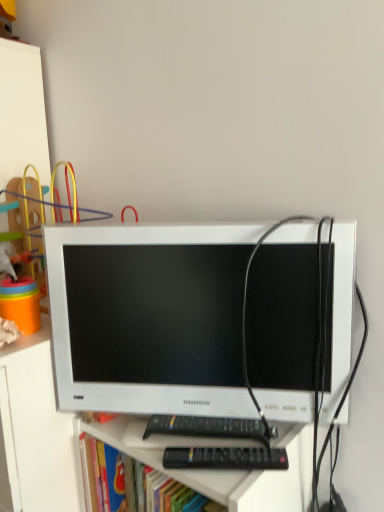
The height and width of the screenshot is (512, 384). What are the coordinates of `white matte file cabinet at left` in the screenshot? It's located at (34, 431).

Looking at this image, does white glossy computer monitor at center have a lesser height compared to black plastic remote at lower center?

No, white glossy computer monitor at center is not shorter than black plastic remote at lower center.

From a real-world perspective, is white glossy computer monitor at center below black plastic remote at lower center?

No, from a real-world perspective, white glossy computer monitor at center is not beneath black plastic remote at lower center.

This screenshot has height=512, width=384. What are the coordinates of `control below the white glossy computer monitor at center (from a real-world perspective)` in the screenshot? It's located at (225, 458).

Are white glossy computer monitor at center and black plastic remote at lower center beside each other?

No, white glossy computer monitor at center is not with black plastic remote at lower center.

Does white glossy computer monitor at center touch white matte file cabinet at left?

There is a gap between white glossy computer monitor at center and white matte file cabinet at left.

Is white glossy computer monitor at center positioned beyond the bounds of white matte file cabinet at left?

Absolutely, white glossy computer monitor at center is external to white matte file cabinet at left.

This screenshot has width=384, height=512. In order to click on file cabinet that is below the white glossy computer monitor at center (from the image's perspective) in this screenshot , I will do `click(34, 431)`.

Is point (183, 271) positioned before point (20, 346)?

Yes, point (183, 271) is in front of point (20, 346).

In the image, is plastic rainbow rings at left positioned in front of or behind black plastic remote at lower center?

plastic rainbow rings at left is positioned farther from the viewer than black plastic remote at lower center.

Is plastic rainbow rings at left oriented away from black plastic remote at lower center?

No.

From a real-world perspective, is plastic rainbow rings at left below black plastic remote at lower center?

Actually, plastic rainbow rings at left is physically above black plastic remote at lower center in the real world.

Consider the image. Which is more to the left, plastic rainbow rings at left or black plastic remote at lower center?

plastic rainbow rings at left.

In the scene shown: Which object is positioned more to the left, black plastic remote at lower center or white matte file cabinet at left?

From the viewer's perspective, white matte file cabinet at left appears more on the left side.

From the image's perspective, which is above, black plastic remote at lower center or white matte file cabinet at left?

black plastic remote at lower center appears higher in the image.

Is black plastic remote at lower center far from white matte file cabinet at left?

Result: That's not correct — black plastic remote at lower center is a little close to white matte file cabinet at left.

What are the coordinates of `control in front of the white matte file cabinet at left` in the screenshot? It's located at (225, 458).

Can you confirm if plastic rainbow rings at left is positioned to the right of white glossy computer monitor at center?

Incorrect, plastic rainbow rings at left is not on the right side of white glossy computer monitor at center.

Does plastic rainbow rings at left have a greater width compared to white glossy computer monitor at center?

Yes, plastic rainbow rings at left is wider than white glossy computer monitor at center.

From the image's perspective, is plastic rainbow rings at left above or below white glossy computer monitor at center?

From the image's perspective, plastic rainbow rings at left appears above white glossy computer monitor at center.

Based on their sizes in the image, would you say plastic rainbow rings at left is bigger or smaller than white glossy computer monitor at center?

Considering their sizes, plastic rainbow rings at left takes up more space than white glossy computer monitor at center.

Which is farther from the camera, [216,448] or [61,164]?

The point [61,164] is more distant.

Does black plastic remote at lower center have a larger size compared to plastic rainbow rings at left?

Actually, black plastic remote at lower center might be smaller than plastic rainbow rings at left.

Who is shorter, black plastic remote at lower center or plastic rainbow rings at left?

black plastic remote at lower center.

From the picture: What's the angular difference between black plastic remote at lower center and plastic rainbow rings at left's facing directions?

The angle between the facing direction of black plastic remote at lower center and the facing direction of plastic rainbow rings at left is 31.7 degrees.

Is white matte file cabinet at left aimed at white glossy computer monitor at center?

No, white matte file cabinet at left is not aimed at white glossy computer monitor at center.

Considering the relative positions of white matte file cabinet at left and white glossy computer monitor at center in the image provided, is white matte file cabinet at left to the right of white glossy computer monitor at center from the viewer's perspective?

Incorrect, white matte file cabinet at left is not on the right side of white glossy computer monitor at center.

Is white matte file cabinet at left bigger than white glossy computer monitor at center?

Indeed, white matte file cabinet at left has a larger size compared to white glossy computer monitor at center.

You are a GUI agent. You are given a task and a screenshot of the screen. Output one action in this format:
    pyautogui.click(x=<x>, y=<y>)
    Task: Click on the computer monitor located on the right of white matte file cabinet at left
    
    Given the screenshot: What is the action you would take?
    pyautogui.click(x=149, y=317)

In order to click on control behind the white glossy computer monitor at center in this screenshot , I will do `click(225, 458)`.

The width and height of the screenshot is (384, 512). What are the coordinates of `file cabinet located on the left of white glossy computer monitor at center` in the screenshot? It's located at (34, 431).

From the image, which object appears to be farther from white glossy computer monitor at center, plastic rainbow rings at left or white matte file cabinet at left?

plastic rainbow rings at left is further to white glossy computer monitor at center.

Based on their spatial positions, is white glossy computer monitor at center or white matte file cabinet at left further from black plastic remote at lower center?

white matte file cabinet at left is positioned further to the anchor black plastic remote at lower center.

Looking at this image, which object lies further to the anchor point white matte file cabinet at left, black plastic remote at lower center or plastic rainbow rings at left?

Based on the image, plastic rainbow rings at left appears to be further to white matte file cabinet at left.

Looking at the image, which one is located further to white glossy computer monitor at center, white matte file cabinet at left or plastic rainbow rings at left?

plastic rainbow rings at left is further to white glossy computer monitor at center.

Based on their spatial positions, is white glossy computer monitor at center or black plastic remote at lower center closer to plastic rainbow rings at left?

Based on the image, white glossy computer monitor at center appears to be nearer to plastic rainbow rings at left.

Estimate the real-world distances between objects in this image. Which object is closer to plastic rainbow rings at left, white matte file cabinet at left or white glossy computer monitor at center?

Among the two, white glossy computer monitor at center is located nearer to plastic rainbow rings at left.

Considering their positions, is white matte file cabinet at left positioned closer to black plastic remote at lower center than white glossy computer monitor at center?

Based on the image, white glossy computer monitor at center appears to be nearer to black plastic remote at lower center.

Based on their spatial positions, is plastic rainbow rings at left or white matte file cabinet at left closer to black plastic remote at lower center?

white matte file cabinet at left lies closer to black plastic remote at lower center than the other object.

This screenshot has height=512, width=384. Find the location of `computer monitor located between white matte file cabinet at left and black plastic remote at lower center in the left-right direction`. computer monitor located between white matte file cabinet at left and black plastic remote at lower center in the left-right direction is located at coordinates (149, 317).

You are a GUI agent. You are given a task and a screenshot of the screen. Output one action in this format:
    pyautogui.click(x=<x>, y=<y>)
    Task: Click on the control between plastic rainbow rings at left and white matte file cabinet at left in the up-down direction
    This screenshot has width=384, height=512.
    Given the screenshot: What is the action you would take?
    pyautogui.click(x=225, y=458)

This screenshot has width=384, height=512. I want to click on computer monitor between plastic rainbow rings at left and white matte file cabinet at left in the up-down direction, so click(149, 317).

Where is `computer monitor located between plastic rainbow rings at left and black plastic remote at lower center in the left-right direction`? This screenshot has height=512, width=384. computer monitor located between plastic rainbow rings at left and black plastic remote at lower center in the left-right direction is located at coordinates (149, 317).